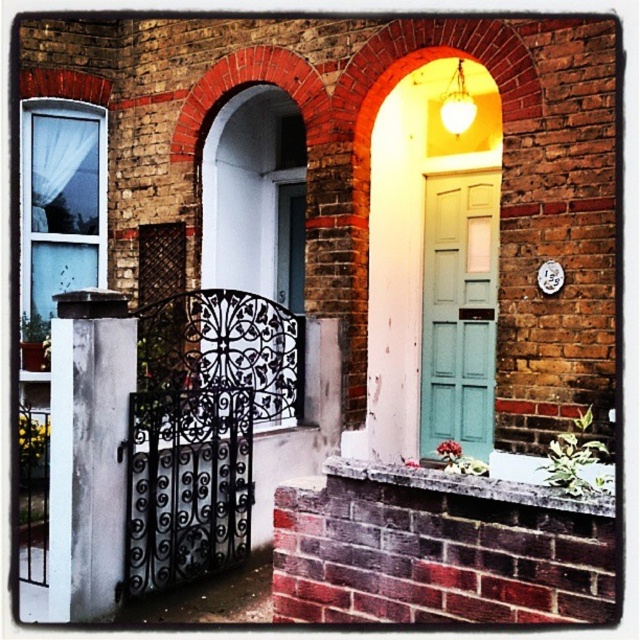
You are standing in front of the building and notice two doors. The teal matte door at center and the smooth white door at center. Which door is closer to you?

The teal matte door at center is closer to you since it is further to the viewer than the smooth white door at center.

You are a delivery person trying to find the correct entrance to a building. You see two doors in front of you, a teal matte door at center and a smooth white door at center. According to the scene description, which door is positioned to the right?

The teal matte door at center is positioned to the right of the smooth white door at center.

You are standing in front of a brick building with two arched doorways. There is a point marked at coordinates point (483, 259). Can you estimate how far this point is from your current position?

The point (483, 259) is 5.58 meters away from the camera, so it is approximately 5.58 meters away from your current position.